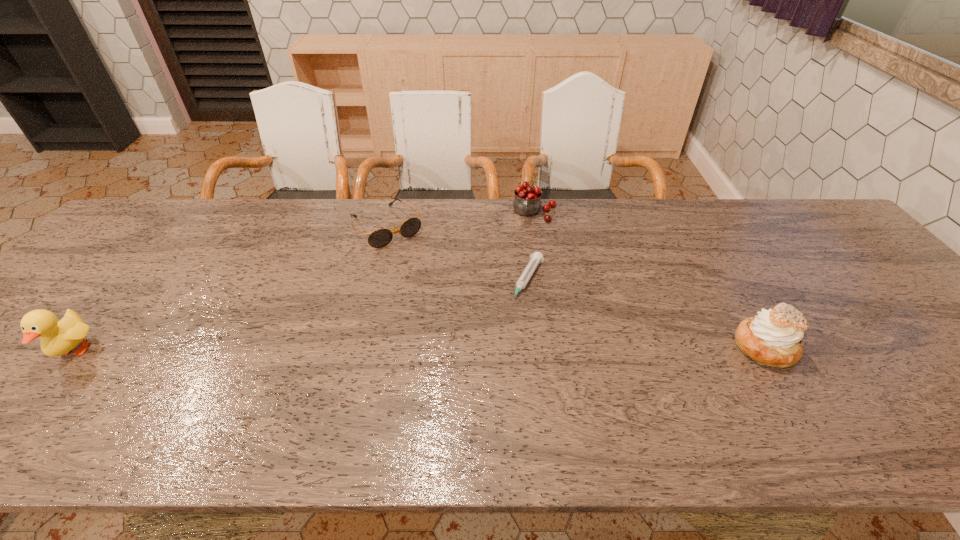
Where is `duckling at the near edge`? This screenshot has height=540, width=960. duckling at the near edge is located at coordinates (58, 338).

This screenshot has height=540, width=960. What are the coordinates of `pastry present at the near edge` in the screenshot? It's located at (773, 338).

Where is `object located in the left edge section of the desktop`? object located in the left edge section of the desktop is located at coordinates (58, 338).

Image resolution: width=960 pixels, height=540 pixels. I want to click on object present at the near left corner, so click(x=58, y=338).

In order to click on free space at the far edge in this screenshot , I will do `click(579, 241)`.

The height and width of the screenshot is (540, 960). Identify the location of free space at the near edge of the desktop. (662, 382).

At what (x,y) coordinates should I click in order to perform the action: click on free space at the left edge. Please return your answer as a coordinate pair (x, y). This screenshot has width=960, height=540. Looking at the image, I should click on (63, 360).

Identify the location of vacant region at the right edge of the desktop. (804, 251).

Where is `vacant space at the far left corner`? vacant space at the far left corner is located at coordinates (176, 227).

You are a GUI agent. You are given a task and a screenshot of the screen. Output one action in this format:
    pyautogui.click(x=<x>, y=<y>)
    Task: Click on the free spot between the pot filled with cherries and the pastry
    Image resolution: width=960 pixels, height=540 pixels.
    Given the screenshot: What is the action you would take?
    [x=649, y=280]